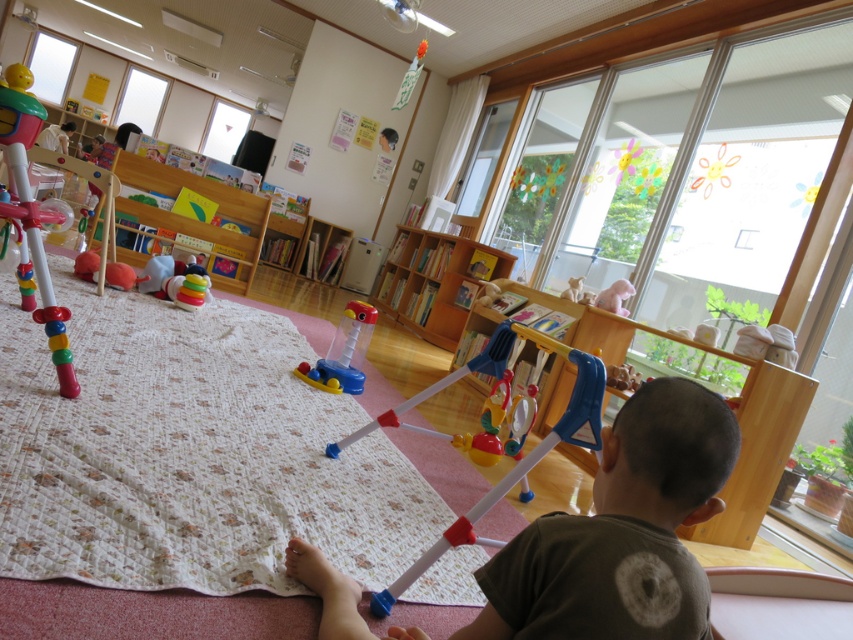
You are a parent looking for a toy for your child. You see the dark green cotton shirt at lower center and the translucent plastic toy at center. Which item is bigger?

The dark green cotton shirt at lower center is larger in size than the translucent plastic toy at center.